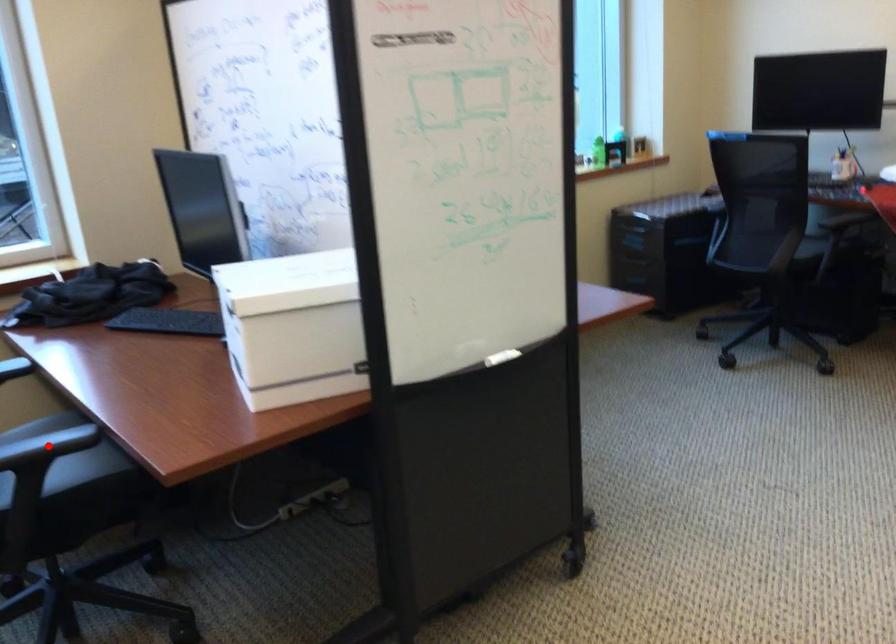
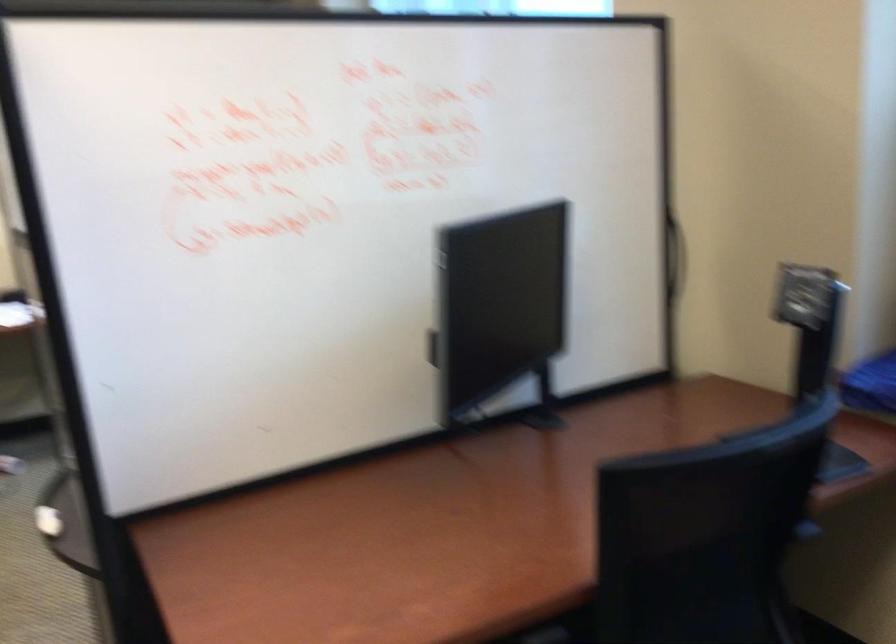
Question: I am providing you with two images of the same scene from different viewpoints. A red point is marked on the first image. Is the red point's position out of view in image 2?

Choices:
 (A) Yes
 (B) No

Answer: (A)